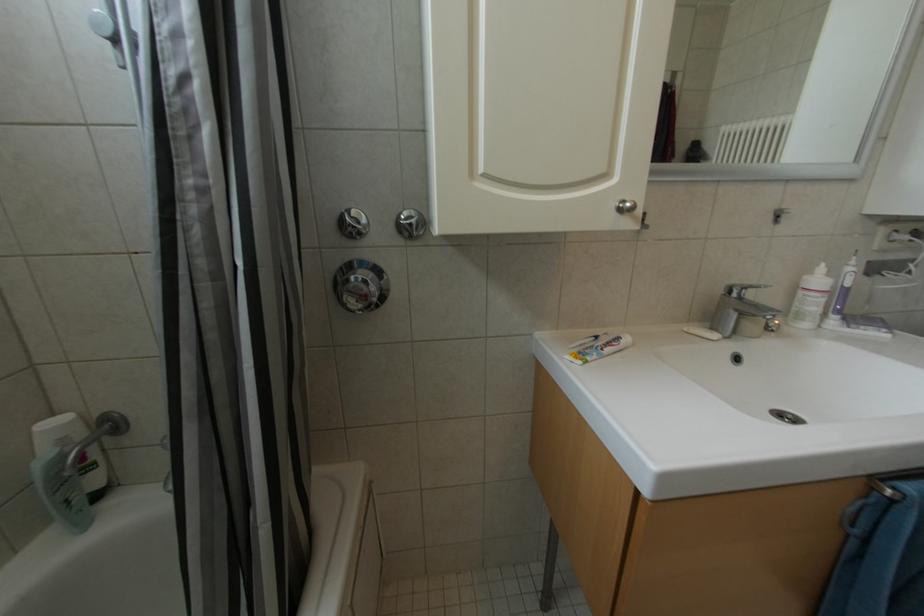
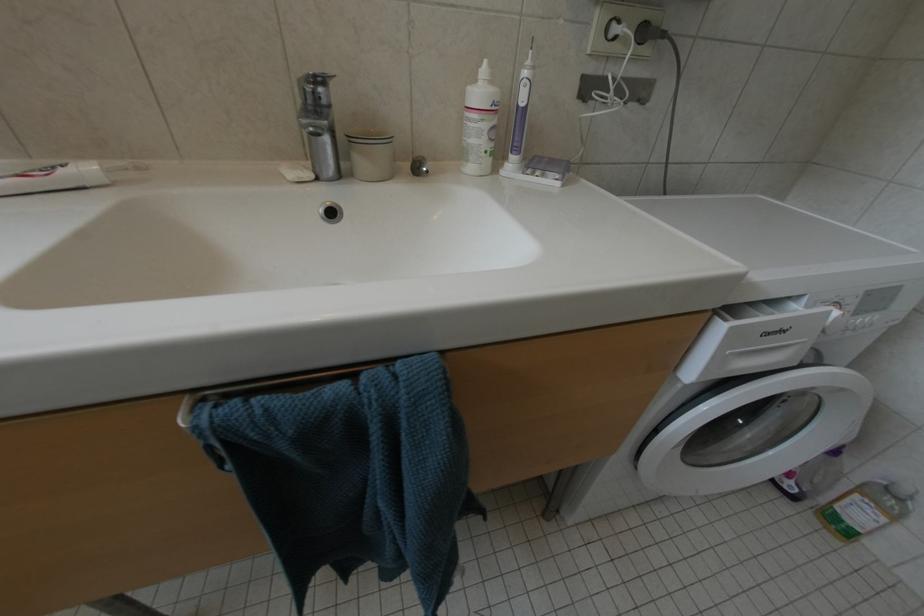
Question: Based on the continuous images, in which direction is the camera rotating? Reply with the corresponding letter.

Choices:
 (A) Left
 (B) Right
 (C) Up
 (D) Down

Answer: (D)